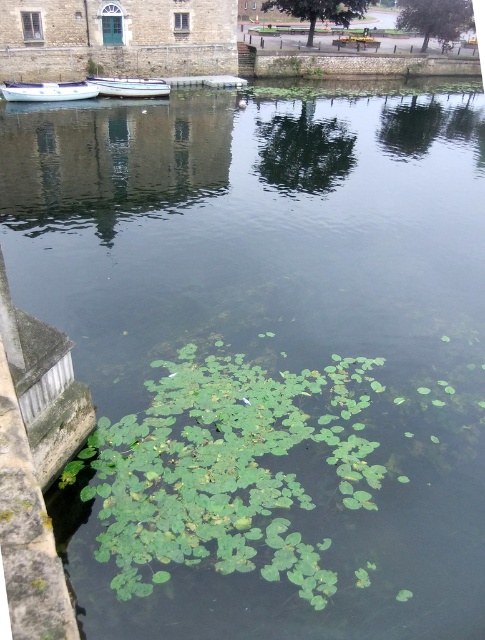
You are standing on the stone wall on the left side of the image. You see the white plastic boat at left and the white glossy boat at center. Which boat is closer to you?

The white plastic boat at left is closer to you because it is in front of the white glossy boat at center.

You are a tourist standing on the dock and want to take a photo of both the white plastic boat at left and the white glossy boat at center. Which boat should you position yourself closer to in order to include both in the frame?

You should position yourself closer to the white plastic boat at left because it is to the left of the white glossy boat at center, allowing both to be captured in the photo frame when centered.

You are a boat operator who needs to choose between the white plastic boat at left and the white glossy boat at center for a trip that requires more stability. Which boat should you choose?

The white glossy boat at center is wider, so it would provide more stability than the white plastic boat at left. Therefore, you should choose the white glossy boat at center.